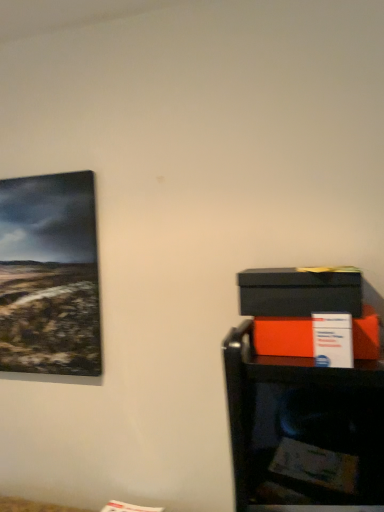
This screenshot has height=512, width=384. Describe the element at coordinates (303, 430) in the screenshot. I see `matte black cabinet at lower right` at that location.

At what (x,y) coordinates should I click in order to perform the action: click on matte black cabinet at lower right. Please return your answer as a coordinate pair (x, y). Looking at the image, I should click on (303, 430).

What do you see at coordinates (283, 336) in the screenshot? This screenshot has height=512, width=384. I see `matte orange box at right, arranged as the 2th box when viewed from the top` at bounding box center [283, 336].

You are a GUI agent. You are given a task and a screenshot of the screen. Output one action in this format:
    pyautogui.click(x=<x>, y=<y>)
    Task: Click on the matte orange box at right, arranged as the 2th box when viewed from the top
    
    Given the screenshot: What is the action you would take?
    pyautogui.click(x=283, y=336)

The width and height of the screenshot is (384, 512). I want to click on matte black box at right, marked as the first box in a top-to-bottom arrangement, so click(x=299, y=292).

Identify the location of matte black cabinet at lower right. Image resolution: width=384 pixels, height=512 pixels. (303, 430).

In the image, is matte orange box at right, arranged as the 2th box when viewed from the top, positioned in front of or behind matte black box at right, marked as the first box in a top-to-bottom arrangement?

matte orange box at right, arranged as the 2th box when viewed from the top, is behind matte black box at right, marked as the first box in a top-to-bottom arrangement.

Between matte orange box at right, arranged as the 2th box when viewed from the top, and matte black box at right, marked as the first box in a top-to-bottom arrangement, which one has larger size?

With larger size is matte black box at right, marked as the first box in a top-to-bottom arrangement.

Is matte orange box at right, which is the first box in bottom-to-top order, beside matte black box at right, which is the 2th box from bottom to top?

Yes, matte orange box at right, which is the first box in bottom-to-top order, is beside matte black box at right, which is the 2th box from bottom to top.

Is matte orange box at right, which is the first box in bottom-to-top order, turned away from matte black box at right, marked as the first box in a top-to-bottom arrangement?

No.

From the image's perspective, which object appears higher, matte black box at right, which is the 2th box from bottom to top, or matte black cabinet at lower right?

matte black box at right, which is the 2th box from bottom to top, is shown above in the image.

Does matte black box at right, marked as the first box in a top-to-bottom arrangement, turn towards matte black cabinet at lower right?

No, matte black box at right, marked as the first box in a top-to-bottom arrangement, is not oriented towards matte black cabinet at lower right.

Considering their positions, is matte black box at right, marked as the first box in a top-to-bottom arrangement, located in front of or behind matte black cabinet at lower right?

Clearly, matte black box at right, marked as the first box in a top-to-bottom arrangement, is in front of matte black cabinet at lower right.

Between matte black box at right, which is the 2th box from bottom to top, and matte black cabinet at lower right, which one has larger width?

matte black box at right, which is the 2th box from bottom to top, is wider.

From the image's perspective, which is below, matte black cabinet at lower right or matte black box at right, marked as the first box in a top-to-bottom arrangement?

matte black cabinet at lower right is shown below in the image.

Between matte black cabinet at lower right and matte black box at right, which is the 2th box from bottom to top, which one has more height?

Standing taller between the two is matte black cabinet at lower right.

Which object is more forward, matte black cabinet at lower right or matte black box at right, marked as the first box in a top-to-bottom arrangement?

matte black box at right, marked as the first box in a top-to-bottom arrangement, is in front.

Which is correct: matte black cabinet at lower right is inside matte black box at right, which is the 2th box from bottom to top, or outside of it?

matte black cabinet at lower right lies outside matte black box at right, which is the 2th box from bottom to top.

From the picture: From the image's perspective, which one is positioned higher, matte black cabinet at lower right or matte orange box at right, which is the first box in bottom-to-top order?

matte orange box at right, which is the first box in bottom-to-top order, from the image's perspective.

Does matte black cabinet at lower right come behind matte orange box at right, which is the first box in bottom-to-top order?

Yes, the depth of matte black cabinet at lower right is greater than that of matte orange box at right, which is the first box in bottom-to-top order.

Locate an element on the screen. The image size is (384, 512). furniture that appears below the matte orange box at right, arranged as the 2th box when viewed from the top (from the image's perspective) is located at coordinates (303, 430).

Is matte black cabinet at lower right wider than matte orange box at right, arranged as the 2th box when viewed from the top?

In fact, matte black cabinet at lower right might be narrower than matte orange box at right, arranged as the 2th box when viewed from the top.

From a real-world perspective, between matte orange box at right, arranged as the 2th box when viewed from the top, and matte black cabinet at lower right, who is vertically lower?

In real-world perspective, matte black cabinet at lower right is lower.

Could you tell me if matte orange box at right, which is the first box in bottom-to-top order, is facing matte black cabinet at lower right?

No, matte orange box at right, which is the first box in bottom-to-top order, is not facing towards matte black cabinet at lower right.

Is point (262, 319) closer or farther from the camera than point (379, 378)?

Point (262, 319) appears to be farther away from the viewer than point (379, 378).

Locate an element on the screen. The image size is (384, 512). box behind the matte black box at right, marked as the first box in a top-to-bottom arrangement is located at coordinates (283, 336).

Is matte black box at right, marked as the first box in a top-to-bottom arrangement, located outside matte orange box at right, arranged as the 2th box when viewed from the top?

Yes, matte black box at right, marked as the first box in a top-to-bottom arrangement, is not within matte orange box at right, arranged as the 2th box when viewed from the top.

Considering the sizes of objects matte black box at right, which is the 2th box from bottom to top, and matte orange box at right, arranged as the 2th box when viewed from the top, in the image provided, who is taller, matte black box at right, which is the 2th box from bottom to top, or matte orange box at right, arranged as the 2th box when viewed from the top,?

Standing taller between the two is matte black box at right, which is the 2th box from bottom to top.

Measure the distance from matte black box at right, marked as the first box in a top-to-bottom arrangement, to matte orange box at right, arranged as the 2th box when viewed from the top.

The distance of matte black box at right, marked as the first box in a top-to-bottom arrangement, from matte orange box at right, arranged as the 2th box when viewed from the top, is 2.72 inches.

Locate an element on the screen. This screenshot has width=384, height=512. box behind the matte black box at right, marked as the first box in a top-to-bottom arrangement is located at coordinates (283, 336).

From a real-world perspective, which box is the 2nd one above the matte black cabinet at lower right? Please provide its 2D coordinates.

[(299, 292)]

When comparing their distances from matte black box at right, which is the 2th box from bottom to top, does matte black cabinet at lower right or matte orange box at right, which is the first box in bottom-to-top order, seem further?

matte black cabinet at lower right.

From the image, which object appears to be nearer to matte orange box at right, arranged as the 2th box when viewed from the top, matte black cabinet at lower right or matte black box at right, marked as the first box in a top-to-bottom arrangement?

Among the two, matte black box at right, marked as the first box in a top-to-bottom arrangement, is located nearer to matte orange box at right, arranged as the 2th box when viewed from the top.

From the image, which object appears to be farther from matte orange box at right, arranged as the 2th box when viewed from the top, matte black box at right, marked as the first box in a top-to-bottom arrangement, or matte black cabinet at lower right?

matte black cabinet at lower right is positioned further to the anchor matte orange box at right, arranged as the 2th box when viewed from the top.

Looking at this image, considering their positions, is matte black box at right, marked as the first box in a top-to-bottom arrangement, positioned closer to matte black cabinet at lower right than matte orange box at right, which is the first box in bottom-to-top order?

Among the two, matte orange box at right, which is the first box in bottom-to-top order, is located nearer to matte black cabinet at lower right.

From the image, which object appears to be farther from matte black cabinet at lower right, matte orange box at right, which is the first box in bottom-to-top order, or matte black box at right, which is the 2th box from bottom to top?

matte black box at right, which is the 2th box from bottom to top, is further to matte black cabinet at lower right.

Considering their positions, is matte orange box at right, arranged as the 2th box when viewed from the top, positioned further to matte black box at right, which is the 2th box from bottom to top, than matte black cabinet at lower right?

matte black cabinet at lower right lies further to matte black box at right, which is the 2th box from bottom to top, than the other object.

Locate an element on the screen. box that lies between matte black box at right, which is the 2th box from bottom to top, and matte black cabinet at lower right from top to bottom is located at coordinates (283, 336).